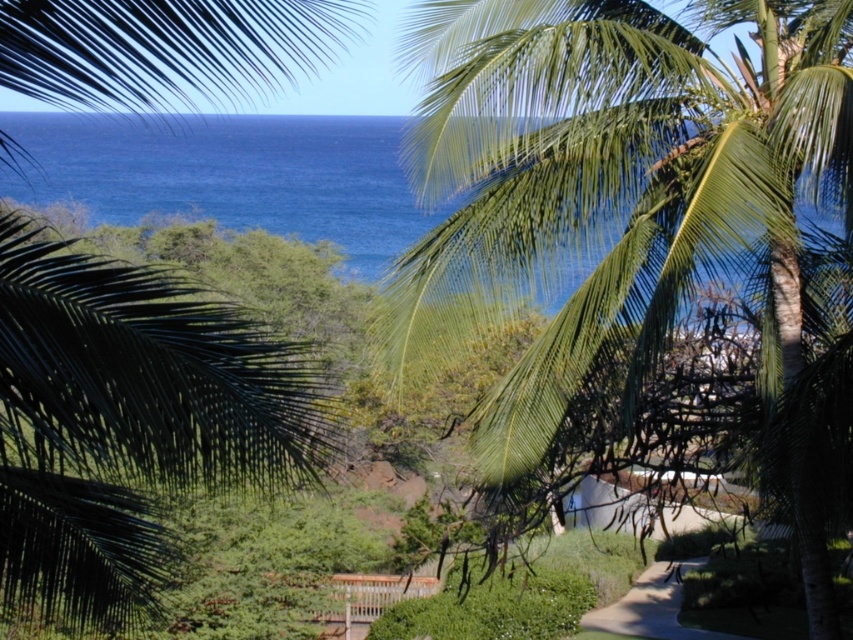
You are standing in the coastal scene and want to take a photo of both the green leafy palm tree at upper right and the green leafy palm tree at upper left. Which direction should you face to have both trees in your camera frame?

You should face towards the center of the scene because the green leafy palm tree at upper right is to the right of the green leafy palm tree at upper left, so positioning yourself in the middle will allow both trees to be captured in the frame.

You are standing in the coastal scene and want to take a photo of both the green leafy palm tree at upper right and the green leafy palm tree at upper left. Which palm tree should you focus on first to ensure both are in the frame?

You should focus on the green leafy palm tree at upper left first because it is closer to you than the green leafy palm tree at upper right, which is further away, ensuring both are in the frame.